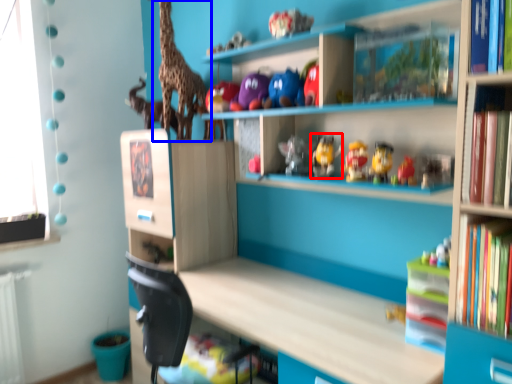
Question: Which object is closer to the camera taking this photo, toy (highlighted by a red box) or giraffe (highlighted by a blue box)?

Choices:
 (A) toy
 (B) giraffe

Answer: (A)